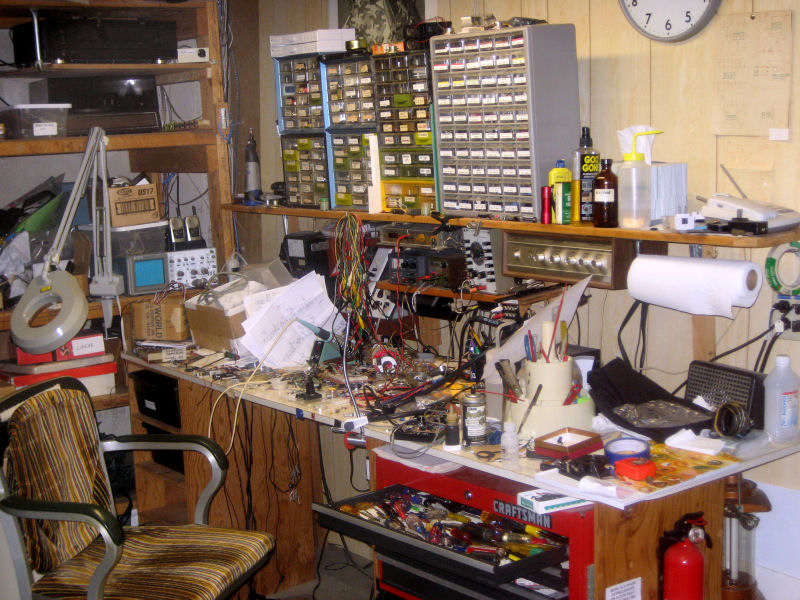
Locate an element on the screen. The height and width of the screenshot is (600, 800). plastic tote is located at coordinates (32, 115).